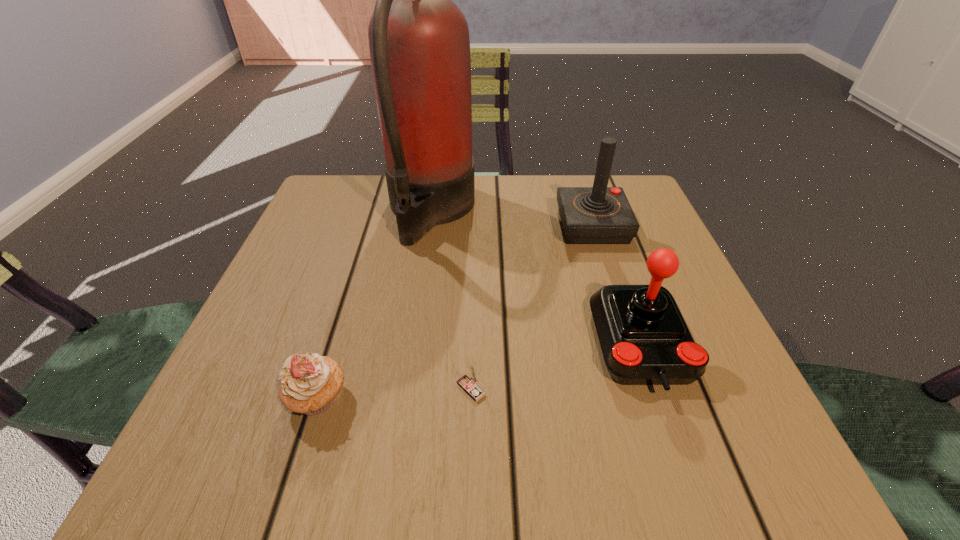
Identify the location of free spot between the fourth tallest object and the fire extinguisher. The image size is (960, 540). (374, 305).

Identify the location of vacant space in between the matchbox and the nearer joystick. The width and height of the screenshot is (960, 540). (557, 367).

Identify the location of free spot between the cupcake and the farther joystick. (455, 312).

The width and height of the screenshot is (960, 540). I want to click on object that is the third closest one to the farther joystick, so tap(468, 383).

The image size is (960, 540). I want to click on object that is the third nearest to the nearer joystick, so click(x=419, y=43).

Image resolution: width=960 pixels, height=540 pixels. I want to click on vacant area in the image that satisfies the following two spatial constraints: 1. on the back side of the shortest object; 2. at the nozzle of the tallest object, so pos(474,211).